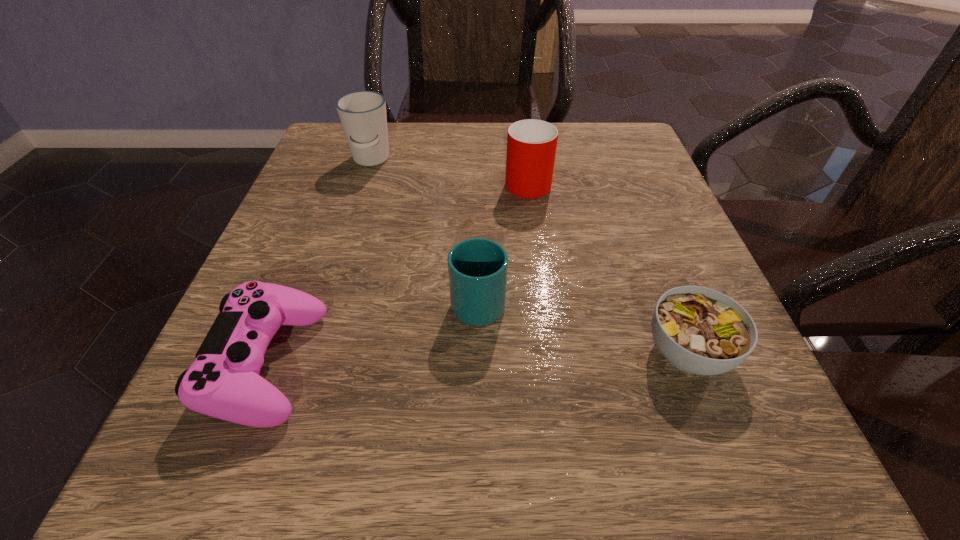
Where is `the leftmost cup`? The height and width of the screenshot is (540, 960). the leftmost cup is located at coordinates (362, 114).

Where is `the rightmost cup`? The height and width of the screenshot is (540, 960). the rightmost cup is located at coordinates (531, 144).

Find the location of a particular element. Image resolution: width=960 pixels, height=540 pixels. the third object from right to left is located at coordinates coord(477,268).

The height and width of the screenshot is (540, 960). Find the location of `the nearest cup`. the nearest cup is located at coordinates (477, 268).

This screenshot has width=960, height=540. What are the coordinates of `control` in the screenshot? It's located at (223, 382).

Image resolution: width=960 pixels, height=540 pixels. In order to click on soup bowl in this screenshot , I will do `click(699, 330)`.

Find the location of a particular element. vacant space located 0.190m with a handle on the side of the leftmost cup is located at coordinates (347, 237).

The height and width of the screenshot is (540, 960). Find the location of `free space located 0.060m on the side of the rightmost cup with the handle`. free space located 0.060m on the side of the rightmost cup with the handle is located at coordinates (523, 148).

This screenshot has height=540, width=960. I want to click on free space located 0.270m on the handle side of the third shortest object, so click(478, 178).

Locate an element on the screen. This screenshot has height=540, width=960. free space located 0.360m on the handle side of the third shortest object is located at coordinates pyautogui.click(x=479, y=154).